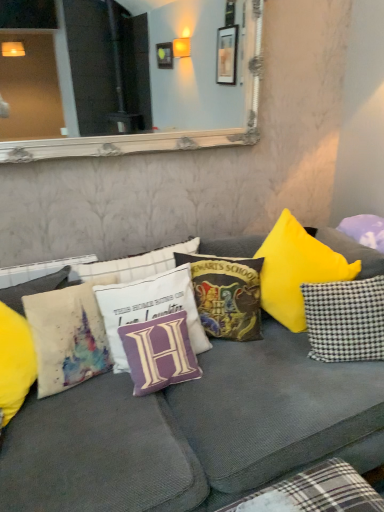
Question: From a real-world perspective, is white textured mirror at upper center positioned under white fabric pillow with purple letter h at center, which is the 2th pillow in left-to-right order, based on gravity?

Choices:
 (A) no
 (B) yes

Answer: (A)

Question: Does white textured mirror at upper center have a greater width compared to white fabric pillow with purple letter h at center, which is the 2th pillow in left-to-right order?

Choices:
 (A) no
 (B) yes

Answer: (A)

Question: Is white textured mirror at upper center far from white fabric pillow with purple letter h at center, the 5th pillow when ordered from right to left?

Choices:
 (A) yes
 (B) no

Answer: (B)

Question: From a real-world perspective, is white textured mirror at upper center on top of white fabric pillow with purple letter h at center, the 5th pillow when ordered from right to left?

Choices:
 (A) no
 (B) yes

Answer: (B)

Question: Can we say white textured mirror at upper center lies outside white fabric pillow with purple letter h at center, which is the 2th pillow in left-to-right order?

Choices:
 (A) yes
 (B) no

Answer: (A)

Question: In the image, is watercolor fabric pillow at left, which is counted as the 6th pillow, starting from the right, positioned in front of or behind purple fabric pillow at center, which appears as the 3th pillow when viewed from the left?

Choices:
 (A) front
 (B) behind

Answer: (A)

Question: From the image's perspective, relative to purple fabric pillow at center, which appears as the 3th pillow when viewed from the left, is watercolor fabric pillow at left, which is counted as the 6th pillow, starting from the right, above or below?

Choices:
 (A) below
 (B) above

Answer: (B)

Question: In terms of height, does watercolor fabric pillow at left, which is counted as the 6th pillow, starting from the right, look taller or shorter compared to purple fabric pillow at center, which appears as the 3th pillow when viewed from the left?

Choices:
 (A) short
 (B) tall

Answer: (B)

Question: Does point (56, 325) appear closer or farther from the camera than point (160, 340)?

Choices:
 (A) closer
 (B) farther

Answer: (A)

Question: Choose the correct answer: Is purple fabric pillow at right, the sixth pillow when ordered from left to right, inside textured gray couch at center or outside it?

Choices:
 (A) outside
 (B) inside

Answer: (A)

Question: In terms of height, does purple fabric pillow at right, the 1th pillow when ordered from right to left, look taller or shorter compared to textured gray couch at center?

Choices:
 (A) short
 (B) tall

Answer: (A)

Question: Looking at the image, does purple fabric pillow at right, the sixth pillow when ordered from left to right, seem bigger or smaller compared to textured gray couch at center?

Choices:
 (A) small
 (B) big

Answer: (A)

Question: Is point (377, 257) closer or farther from the camera than point (182, 458)?

Choices:
 (A) farther
 (B) closer

Answer: (A)

Question: In terms of height, does checkered fabric pillow at right, which appears as the 5th pillow when viewed from the left, look taller or shorter compared to purple fabric pillow at right, the 1th pillow when ordered from right to left?

Choices:
 (A) short
 (B) tall

Answer: (B)

Question: Choose the correct answer: Is checkered fabric pillow at right, which appears as the 5th pillow when viewed from the left, inside purple fabric pillow at right, the sixth pillow when ordered from left to right, or outside it?

Choices:
 (A) inside
 (B) outside

Answer: (B)